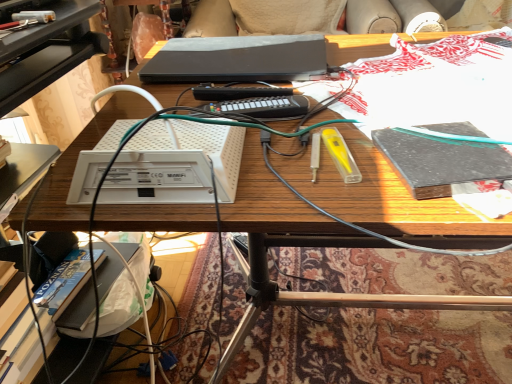
Image resolution: width=512 pixels, height=384 pixels. What are the coordinates of `free space that is to the left of black matte book at right` in the screenshot? It's located at (318, 174).